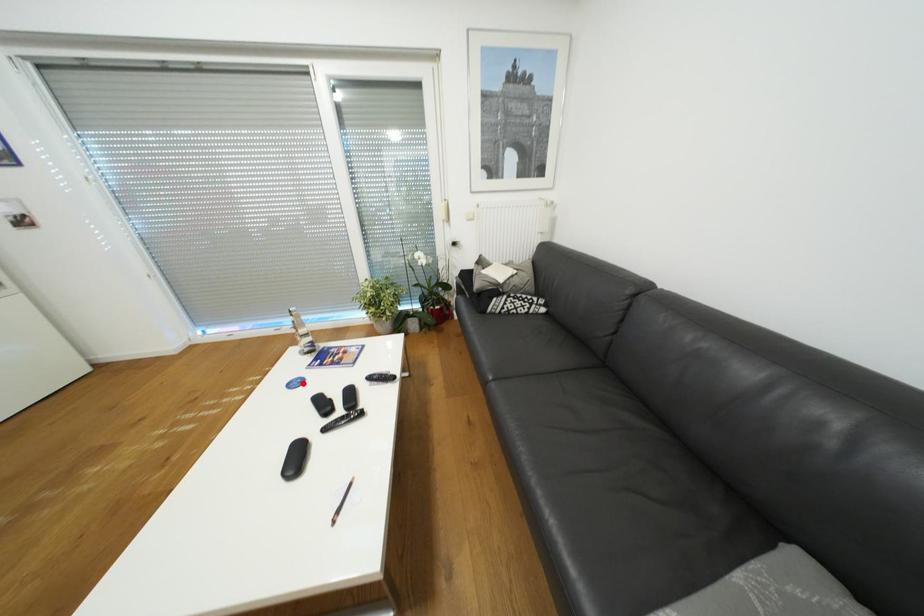
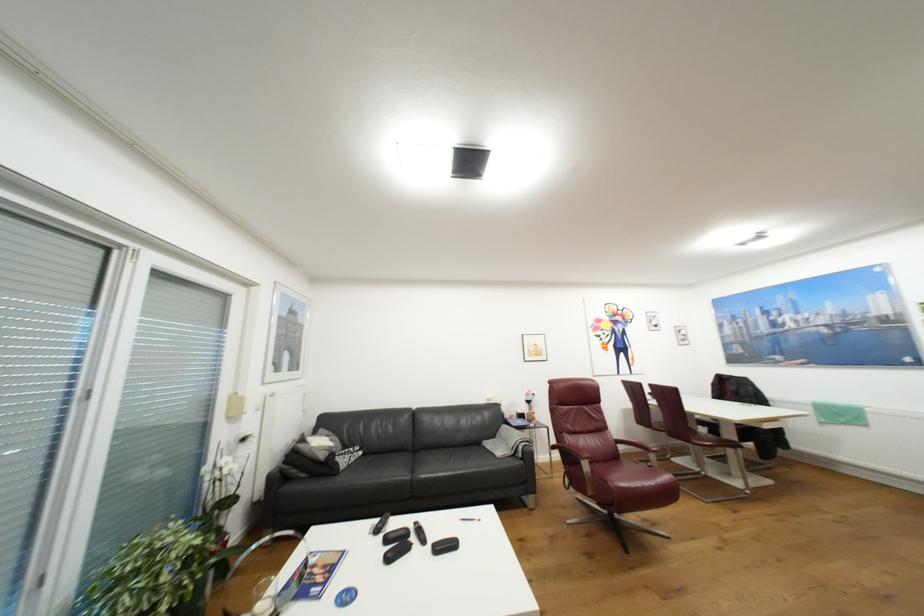
In the second image, find the point that corresponds to the highlighted location in the first image.

(354, 597)